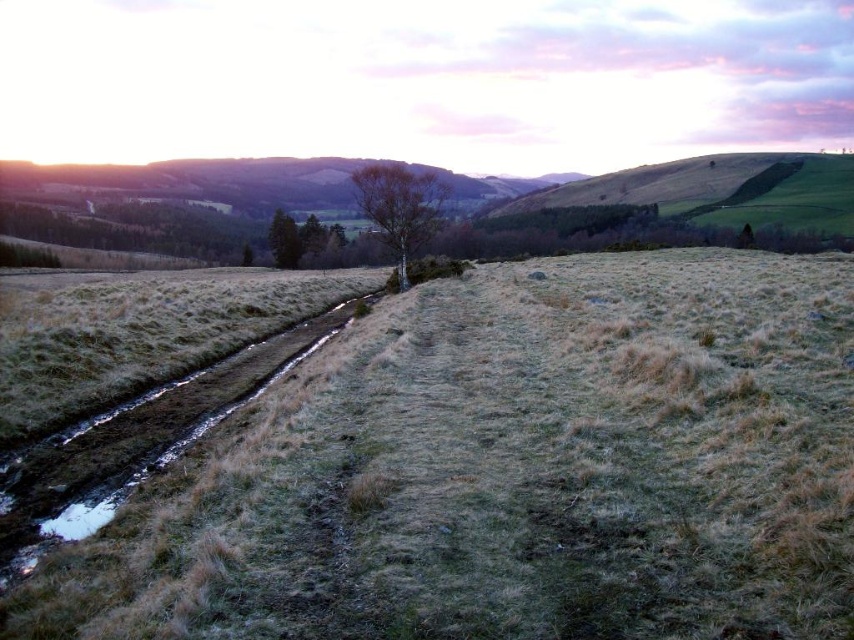
Question: Which point is closer to the camera?

Choices:
 (A) green grassy hillside at upper right
 (B) bare wood tree at center

Answer: (B)

Question: Estimate the real-world distances between objects in this image. Which object is closer to the bare wood tree at center?

Choices:
 (A) green matte tree at center
 (B) dry grass at center
 (C) green grassy hillside at upper right
 (D) bare tree at center

Answer: (B)

Question: Estimate the real-world distances between objects in this image. Which object is closer to the dry grass at center?

Choices:
 (A) green grassy hillside at upper right
 (B) green matte tree at center
 (C) bare tree at center
 (D) bare wood tree at center

Answer: (D)

Question: Is green grassy hillside at upper right to the right of bare wood tree at center from the viewer's perspective?

Choices:
 (A) no
 (B) yes

Answer: (B)

Question: Does green grassy hillside at upper right appear under green matte tree at center?

Choices:
 (A) yes
 (B) no

Answer: (B)

Question: Considering the relative positions of green grassy hillside at upper right and bare wood tree at center in the image provided, where is green grassy hillside at upper right located with respect to bare wood tree at center?

Choices:
 (A) right
 (B) left

Answer: (A)